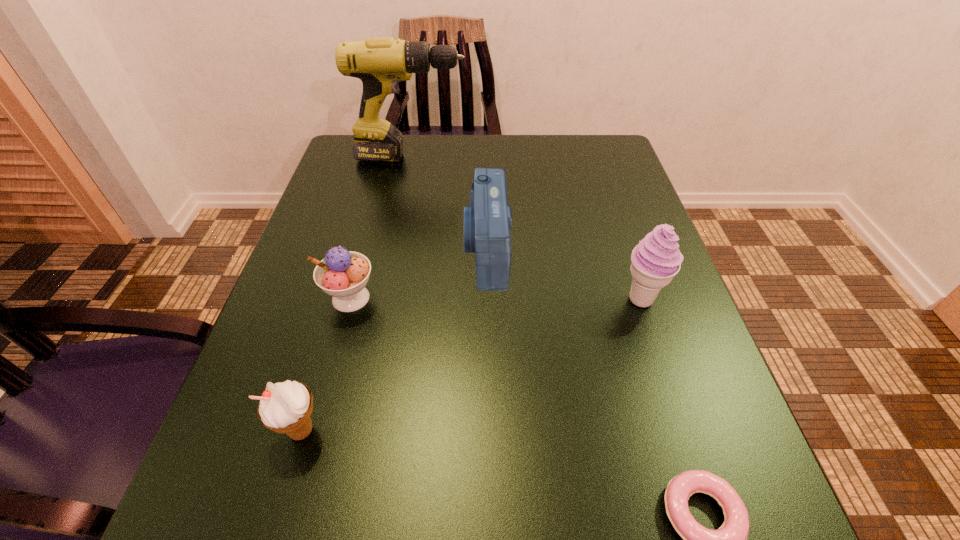
In the image, there is a desktop. Where is `vacant space at the near left corner`? This screenshot has height=540, width=960. vacant space at the near left corner is located at coordinates (228, 487).

Where is `free location at the far right corner`? The image size is (960, 540). free location at the far right corner is located at coordinates (600, 143).

Identify the location of vacant space that is in between the second nearest object and the fifth shortest object. (471, 364).

Point out which object is positioned as the fifth nearest to the shortest object. Please provide its 2D coordinates. Your answer should be formatted as a tuple, i.e. [(x, y)], where the tuple contains the x and y coordinates of a point satisfying the conditions above.

[(380, 63)]

Where is `object that is the fifth closest to the nearest object`? The height and width of the screenshot is (540, 960). object that is the fifth closest to the nearest object is located at coordinates (380, 63).

Locate an element on the screen. the closest icecream relative to the nearest icecream is located at coordinates (343, 274).

Locate which icecream ranks second in proximity to the nearest icecream. Please provide its 2D coordinates. Your answer should be formatted as a tuple, i.e. [(x, y)], where the tuple contains the x and y coordinates of a point satisfying the conditions above.

[(655, 261)]

The image size is (960, 540). I want to click on vacant region that satisfies the following two spatial constraints: 1. on the back side of the tallest icecream; 2. on the lens of the fourth object from left to right, so click(x=625, y=250).

This screenshot has height=540, width=960. In order to click on vacant area in the image that satisfies the following two spatial constraints: 1. on the handle side of the tallest object; 2. on the right side of the fifth shortest object in this screenshot , I will do `click(382, 299)`.

Find the location of a particular element. vacant point that satisfies the following two spatial constraints: 1. on the lens of the second tallest object; 2. on the left side of the third object from right to left is located at coordinates (487, 299).